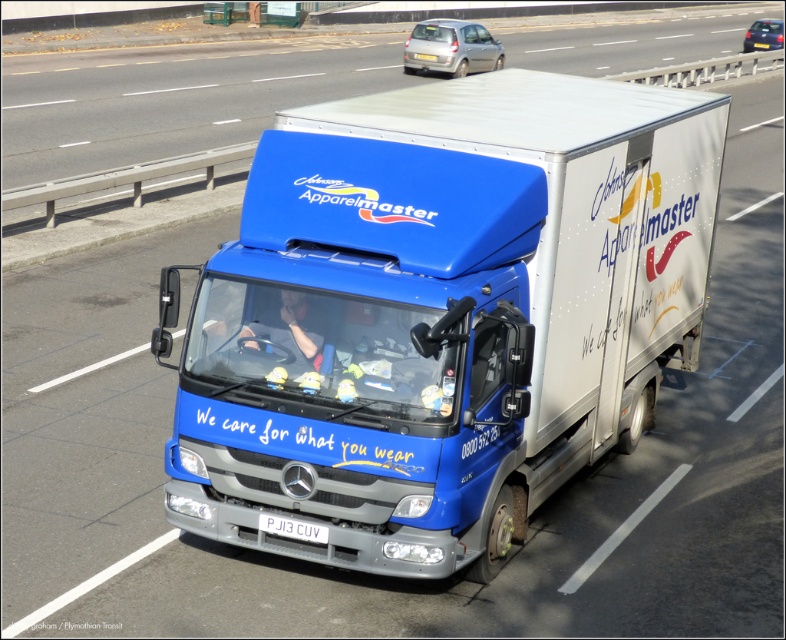
You are a pedestrian standing on the sidewalk and see the blue metallic truck at center and the white plastic license plate at center. Which object is nearer to you?

The blue metallic truck at center is closer to the viewer than the white plastic license plate at center, so the blue metallic truck at center is nearer to you.

In the scene shown: You are a traffic officer who needs to ensure that the blue metallic truck at center and the white plastic license plate at center are within the legal width limit for vehicles on this road. Can you determine if both are within the limit based on their widths?

The blue metallic truck at center might be wider than white plastic license plate at center, so it is possible that the truck exceeds the legal width limit while the license plate is within the limit. Further measurement is needed to confirm.

You are a pedestrian standing on the sidewalk observing the blue metallic truck at center and the white plastic license plate at center. Which object is positioned higher from the ground?

The blue metallic truck at center is positioned higher than the white plastic license plate at center because it is above it.